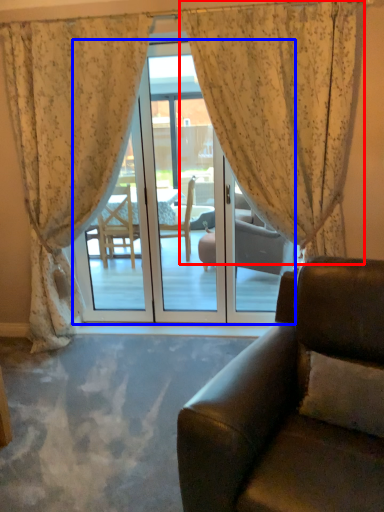
Question: Which object appears farthest to the camera in this image, curtain (highlighted by a red box) or door (highlighted by a blue box)?

Choices:
 (A) curtain
 (B) door

Answer: (B)